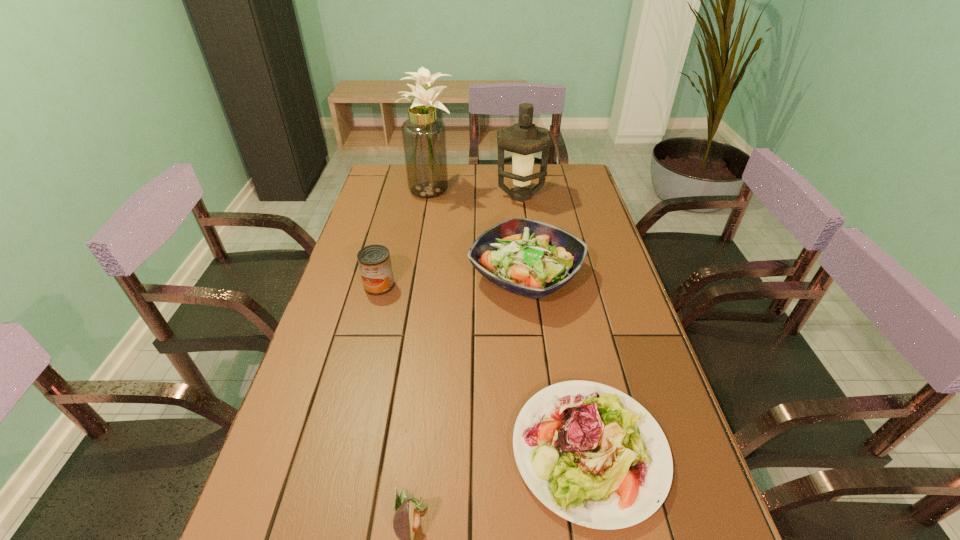
I want to click on vacant space situated on the left of the shortest object, so click(444, 450).

At what (x,y) coordinates should I click in order to perform the action: click on flower arrangement present at the far edge. Please return your answer as a coordinate pair (x, y). Looking at the image, I should click on (424, 137).

Find the location of `oil lamp that is at the far edge`. oil lamp that is at the far edge is located at coordinates (523, 139).

Where is `flower arrangement present at the left edge`? flower arrangement present at the left edge is located at coordinates [424, 137].

Where is `can at the left edge`? The height and width of the screenshot is (540, 960). can at the left edge is located at coordinates (374, 261).

The image size is (960, 540). Identify the location of object situated at the far left corner. (x=424, y=137).

Where is `vacant space at the far edge of the desktop`? The height and width of the screenshot is (540, 960). vacant space at the far edge of the desktop is located at coordinates (491, 178).

Locate an element on the screen. This screenshot has height=540, width=960. free space at the left edge of the desktop is located at coordinates (393, 195).

In the image, there is a desktop. Where is `vacant space at the right edge`? The width and height of the screenshot is (960, 540). vacant space at the right edge is located at coordinates [x=591, y=206].

Identify the location of blank area at the far left corner. The image size is (960, 540). (405, 188).